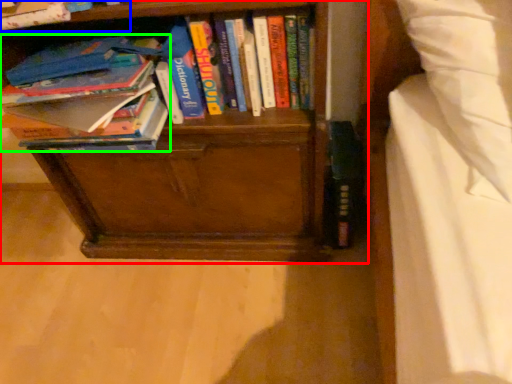
Question: Which is nearer to the bookcase (highlighted by a red box)? book (highlighted by a blue box) or book (highlighted by a green box).

Choices:
 (A) book
 (B) book

Answer: (B)